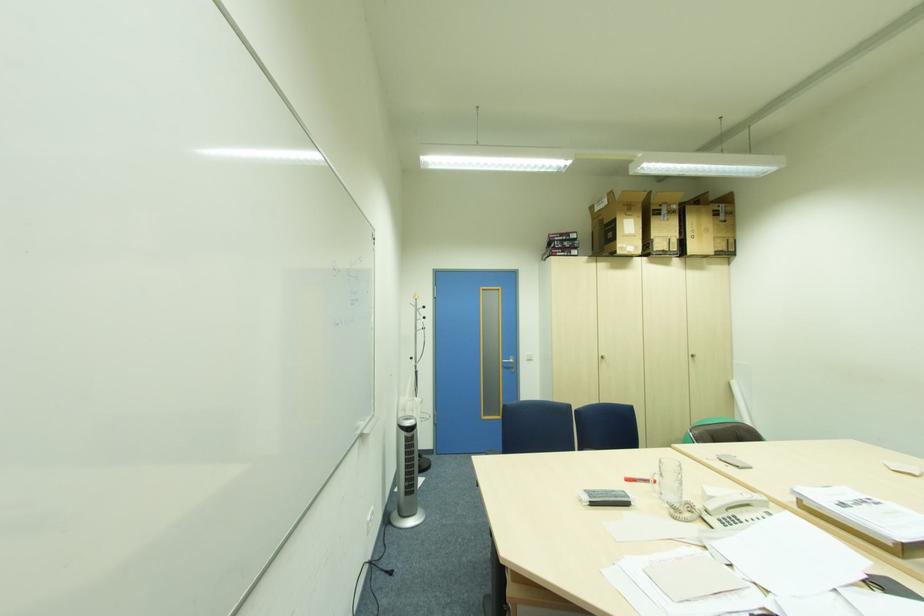
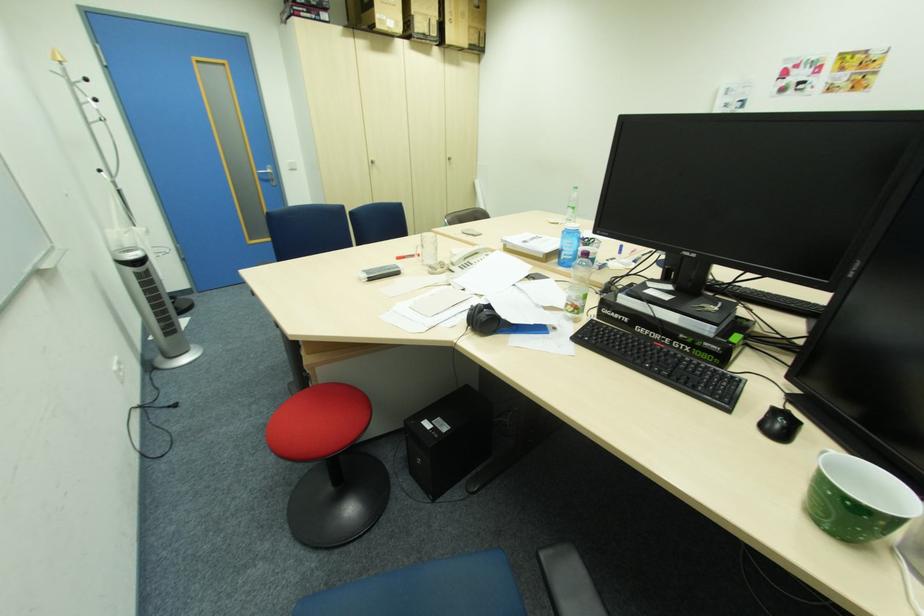
In the second image, find the point that corresponds to (x=740, y=517) in the first image.

(475, 262)